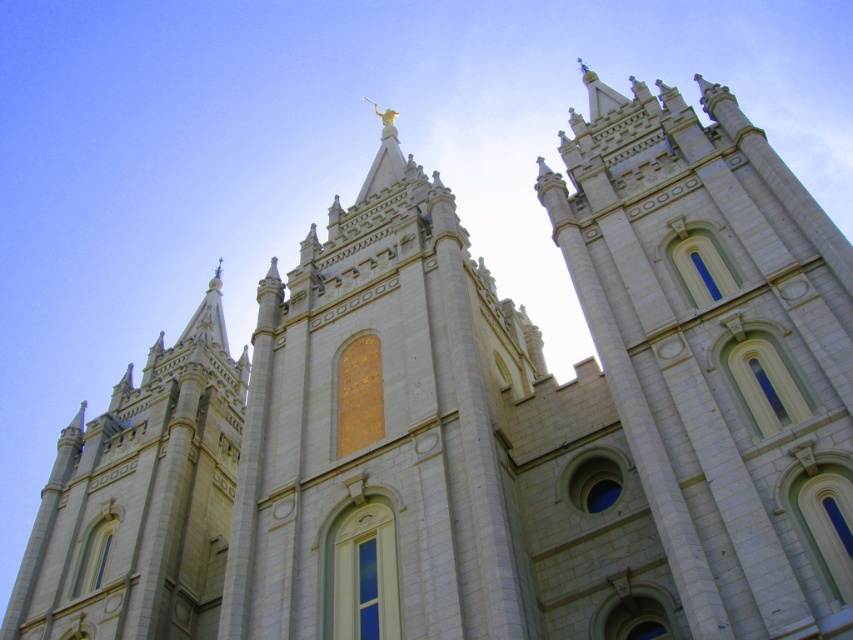
What do you see at coordinates (718, 349) in the screenshot?
I see `white stone tower at upper center` at bounding box center [718, 349].

Does white stone tower at upper center have a larger size compared to gold textured statue at center?

No, white stone tower at upper center is not bigger than gold textured statue at center.

The image size is (853, 640). I want to click on white stone tower at upper center, so pyautogui.click(x=718, y=349).

This screenshot has width=853, height=640. Find the location of `white stone tower at upper center`. white stone tower at upper center is located at coordinates (718, 349).

Measure the distance from white stone tower at upper center to white stone tower at left.

They are 39.97 meters apart.

Consider the image. Is white stone tower at upper center wider than white stone tower at left?

No, white stone tower at upper center is not wider than white stone tower at left.

In order to click on white stone tower at upper center in this screenshot , I will do `click(718, 349)`.

How far apart are gold textured statue at center and white stone tower at left?

gold textured statue at center and white stone tower at left are 61.48 feet apart from each other.

Does gold textured statue at center appear on the right side of white stone tower at left?

Yes, gold textured statue at center is to the right of white stone tower at left.

Does point (521, 556) come farther from viewer compared to point (196, 360)?

No, it is in front of (196, 360).

What are the coordinates of `gold textured statue at center` in the screenshot? It's located at (379, 429).